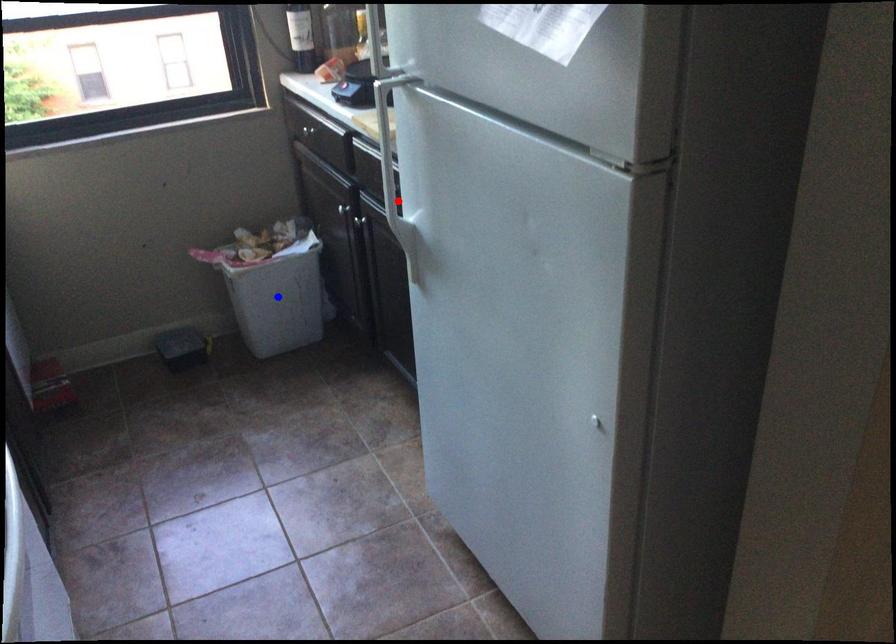
Question: In the image, two points are highlighted. Which point is nearer to the camera? Reply with the corresponding letter.

Choices:
 (A) blue point
 (B) red point

Answer: (B)